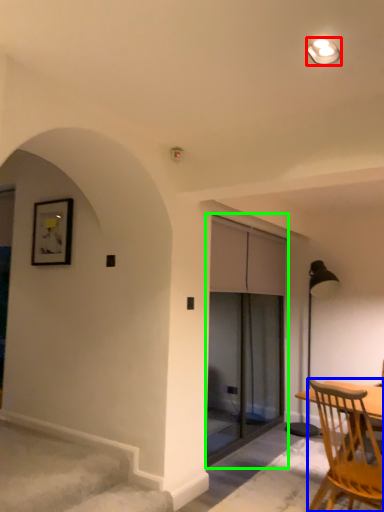
Question: Based on their relative distances, which object is nearer to light fixture (highlighted by a red box)? Choose from chair (highlighted by a blue box) and screen door (highlighted by a green box).

Choices:
 (A) chair
 (B) screen door

Answer: (A)